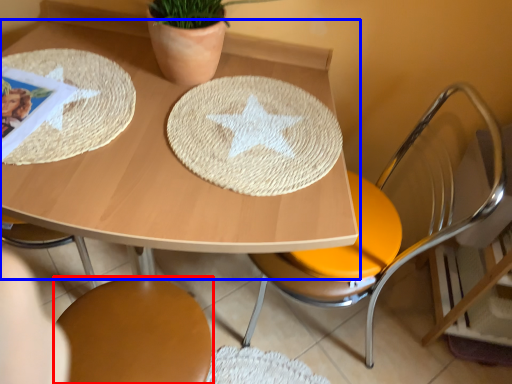
Question: Which object appears farthest to the camera in this image, chair (highlighted by a red box) or table (highlighted by a blue box)?

Choices:
 (A) chair
 (B) table

Answer: (A)